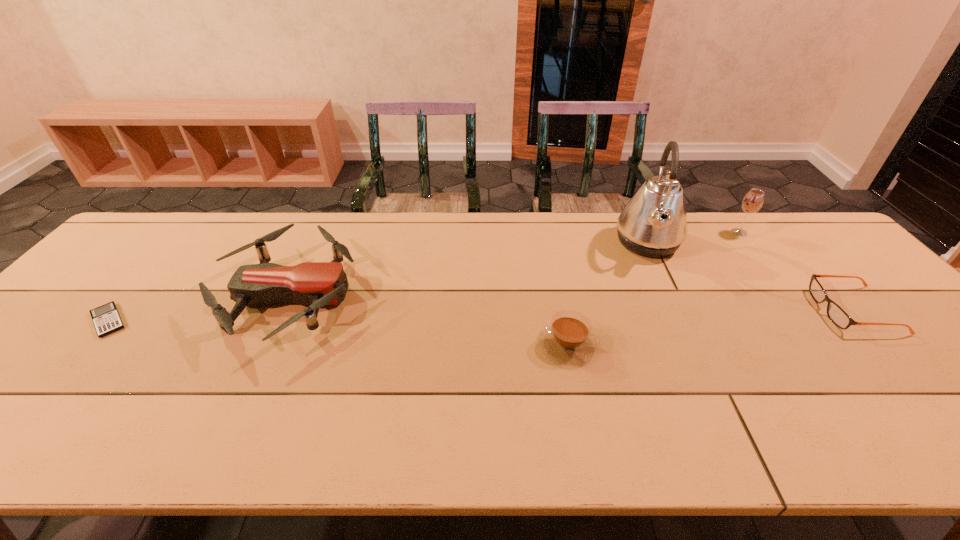
Identify the location of vacant region between the leftmost object and the rightmost object. The image size is (960, 540). pos(481,315).

At what (x,y) coordinates should I click in order to perform the action: click on object that is the fifth closest to the third object from right to left. Please return your answer as a coordinate pair (x, y). Looking at the image, I should click on (106, 319).

Identify which object is the fourth closest to the fifth shortest object. Please provide its 2D coordinates. Your answer should be formatted as a tuple, i.e. [(x, y)], where the tuple contains the x and y coordinates of a point satisfying the conditions above.

[(317, 284)]

Where is `free space that satisfies the following two spatial constraints: 1. on the front side of the third object from left to right; 2. on the left side of the shortest object`? This screenshot has height=540, width=960. free space that satisfies the following two spatial constraints: 1. on the front side of the third object from left to right; 2. on the left side of the shortest object is located at coordinates (86, 345).

This screenshot has width=960, height=540. I want to click on vacant space that satisfies the following two spatial constraints: 1. on the front side of the third object from right to left; 2. on the front-facing side of the fourth shortest object, so click(673, 296).

At what (x,y) coordinates should I click in order to perform the action: click on vacant point that satisfies the following two spatial constraints: 1. on the front-facing side of the drone; 2. on the front side of the leftmost object. Please return your answer as a coordinate pair (x, y). This screenshot has height=540, width=960. Looking at the image, I should click on (276, 321).